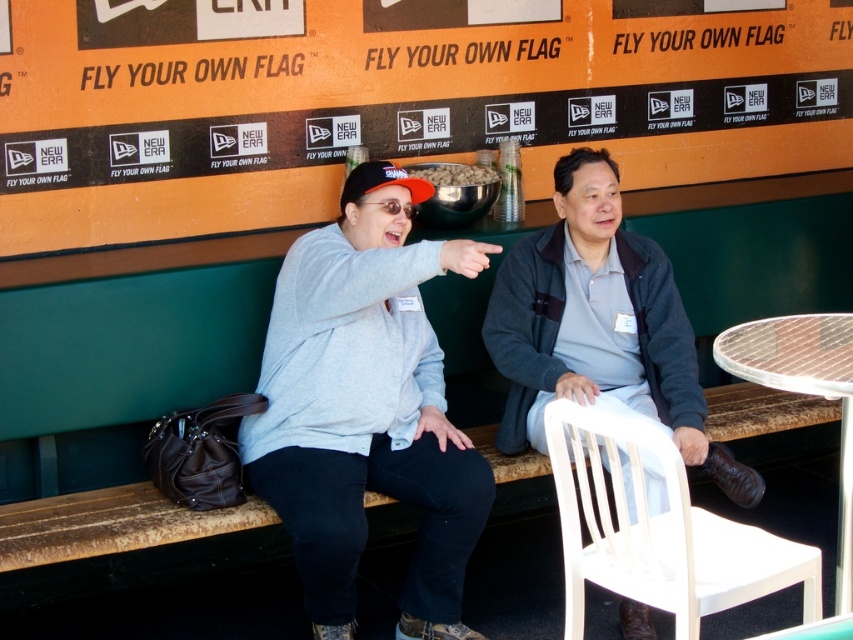
What do you see at coordinates (366, 408) in the screenshot?
I see `matte gray sweatshirt at center` at bounding box center [366, 408].

Is matte gray sweatshirt at center in front of gray fleece jacket at center?

Yes, matte gray sweatshirt at center is in front of gray fleece jacket at center.

This screenshot has height=640, width=853. In order to click on matte gray sweatshirt at center in this screenshot , I will do `click(366, 408)`.

What are the coordinates of `matte gray sweatshirt at center` in the screenshot? It's located at (366, 408).

Can you confirm if matte gray sweatshirt at center is positioned below white plastic chair at lower right?

Incorrect, matte gray sweatshirt at center is not positioned below white plastic chair at lower right.

This screenshot has height=640, width=853. I want to click on matte gray sweatshirt at center, so click(366, 408).

This screenshot has width=853, height=640. What are the coordinates of `matte gray sweatshirt at center` in the screenshot? It's located at (366, 408).

Does point (637, 568) come farther from viewer compared to point (840, 451)?

No, it is in front of (840, 451).

This screenshot has height=640, width=853. What do you see at coordinates (656, 524) in the screenshot? I see `white plastic chair at lower right` at bounding box center [656, 524].

Does point (572, 524) come in front of point (759, 339)?

Yes.

Locate an element on the screen. The height and width of the screenshot is (640, 853). white plastic chair at lower right is located at coordinates (656, 524).